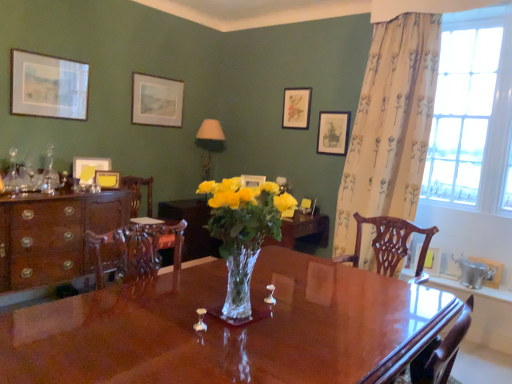
Question: Is yellow paper at left, the third picture frame when ordered from left to right, behind wooden picture frame at right, marked as the 8th picture frame in a left-to-right arrangement?

Choices:
 (A) no
 (B) yes

Answer: (A)

Question: Is yellow paper at left, positioned as the seventh picture frame in right-to-left order, looking in the opposite direction of wooden picture frame at right, marked as the 8th picture frame in a left-to-right arrangement?

Choices:
 (A) yes
 (B) no

Answer: (B)

Question: Considering the relative sizes of yellow paper at left, positioned as the seventh picture frame in right-to-left order, and wooden picture frame at right, the 2th picture frame viewed from the right, in the image provided, is yellow paper at left, positioned as the seventh picture frame in right-to-left order, taller than wooden picture frame at right, the 2th picture frame viewed from the right,?

Choices:
 (A) yes
 (B) no

Answer: (B)

Question: Can we say yellow paper at left, the third picture frame when ordered from left to right, lies outside wooden picture frame at right, marked as the 8th picture frame in a left-to-right arrangement?

Choices:
 (A) no
 (B) yes

Answer: (B)

Question: Does yellow paper at left, the third picture frame when ordered from left to right, have a lesser height compared to wooden picture frame at right, the 2th picture frame viewed from the right?

Choices:
 (A) no
 (B) yes

Answer: (B)

Question: From the image's perspective, is matte paper picture frame at upper center, which appears as the sixth picture frame when viewed from the right, above or below floral fabric curtain at right?

Choices:
 (A) below
 (B) above

Answer: (B)

Question: Considering the positions of point (138, 117) and point (404, 119), is point (138, 117) closer or farther from the camera than point (404, 119)?

Choices:
 (A) closer
 (B) farther

Answer: (B)

Question: Would you say matte paper picture frame at upper center, which appears as the sixth picture frame when viewed from the right, is inside or outside floral fabric curtain at right?

Choices:
 (A) outside
 (B) inside

Answer: (A)

Question: In terms of height, does matte paper picture frame at upper center, the fourth picture frame when ordered from left to right, look taller or shorter compared to floral fabric curtain at right?

Choices:
 (A) short
 (B) tall

Answer: (A)

Question: From the image's perspective, is carved wood chair at center positioned above or below matte white picture frame at center, acting as the sixth picture frame starting from the left?

Choices:
 (A) above
 (B) below

Answer: (B)

Question: Is carved wood chair at center inside or outside of matte white picture frame at center, acting as the sixth picture frame starting from the left?

Choices:
 (A) inside
 (B) outside

Answer: (B)

Question: Considering their positions, is carved wood chair at center located in front of or behind matte white picture frame at center, placed as the 4th picture frame when sorted from right to left?

Choices:
 (A) behind
 (B) front

Answer: (B)

Question: Looking at the image, does carved wood chair at center seem bigger or smaller compared to matte white picture frame at center, placed as the 4th picture frame when sorted from right to left?

Choices:
 (A) small
 (B) big

Answer: (B)

Question: Is yellow paper at left, positioned as the seventh picture frame in right-to-left order, to the left or to the right of matte paper picture frame at upper center, the fourth picture frame when ordered from left to right, in the image?

Choices:
 (A) right
 (B) left

Answer: (B)

Question: Does point (117, 175) appear closer or farther from the camera than point (178, 115)?

Choices:
 (A) farther
 (B) closer

Answer: (B)